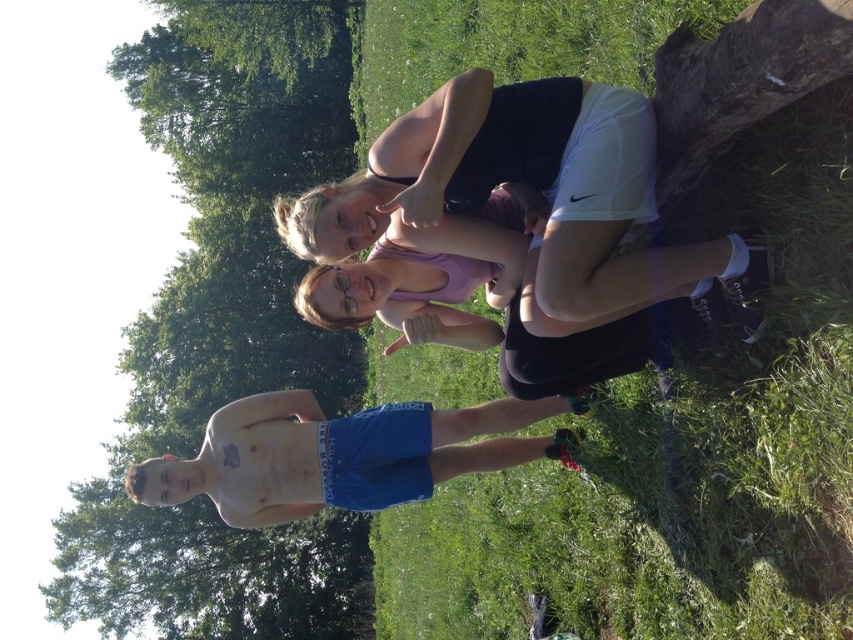
Who is positioned more to the right, matte black tank top at upper center or blue cotton shorts at lower left?

matte black tank top at upper center is more to the right.

Who is lower down, matte black tank top at upper center or blue cotton shorts at lower left?

blue cotton shorts at lower left is below.

What do you see at coordinates (527, 193) in the screenshot? I see `matte black tank top at upper center` at bounding box center [527, 193].

You are a GUI agent. You are given a task and a screenshot of the screen. Output one action in this format:
    pyautogui.click(x=<x>, y=<y>)
    Task: Click on the matte black tank top at upper center
    The width and height of the screenshot is (853, 640).
    Given the screenshot: What is the action you would take?
    pyautogui.click(x=527, y=193)

From the picture: Which is below, green grass at upper right or green leafy tree at upper center?

green grass at upper right is below.

Is point (759, 625) positioned behind point (90, 518)?

No, it is not.

I want to click on green grass at upper right, so (x=686, y=417).

Is green leafy tree at upper center bigger than pink fabric at center?

Yes.

Who is lower down, green leafy tree at upper center or pink fabric at center?

pink fabric at center

I want to click on green leafy tree at upper center, so click(x=225, y=330).

Locate an element on the screen. The height and width of the screenshot is (640, 853). green leafy tree at upper center is located at coordinates (225, 330).